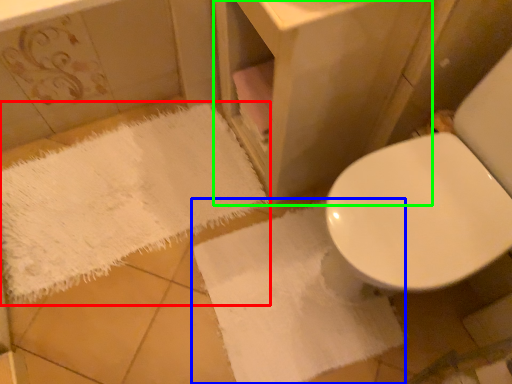
Question: Based on their relative distances, which object is nearer to bath towel (highlighted by a red box)? Choose from bath towel (highlighted by a blue box) and vanity (highlighted by a green box).

Choices:
 (A) bath towel
 (B) vanity

Answer: (A)